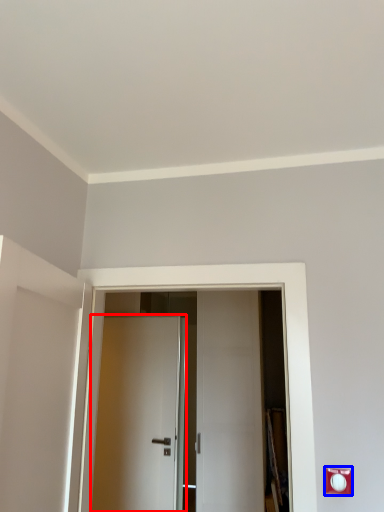
Question: Which object appears closest to the camera in this image, door (highlighted by a red box) or electric outlet (highlighted by a blue box)?

Choices:
 (A) door
 (B) electric outlet

Answer: (B)